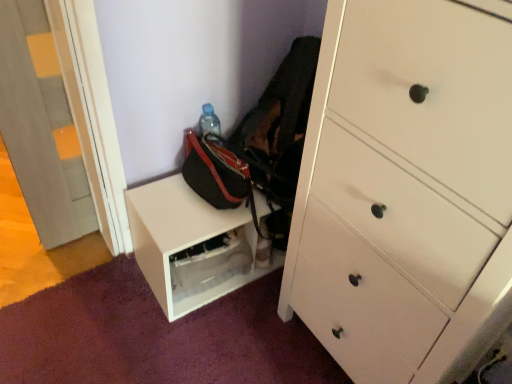
You are a GUI agent. You are given a task and a screenshot of the screen. Output one action in this format:
    pyautogui.click(x=<x>, y=<y>)
    Task: Click on the free point to the right of matte gray door at left
    The image size is (512, 384).
    Given the screenshot: What is the action you would take?
    pyautogui.click(x=98, y=251)